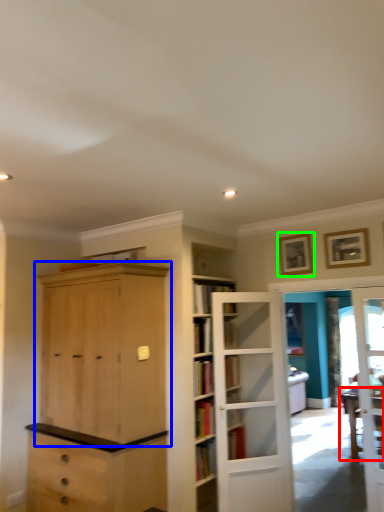
Question: Which object is the farthest from table (highlighted by a red box)? Choose among these: cabinetry (highlighted by a blue box) or picture frame (highlighted by a green box).

Choices:
 (A) cabinetry
 (B) picture frame

Answer: (A)